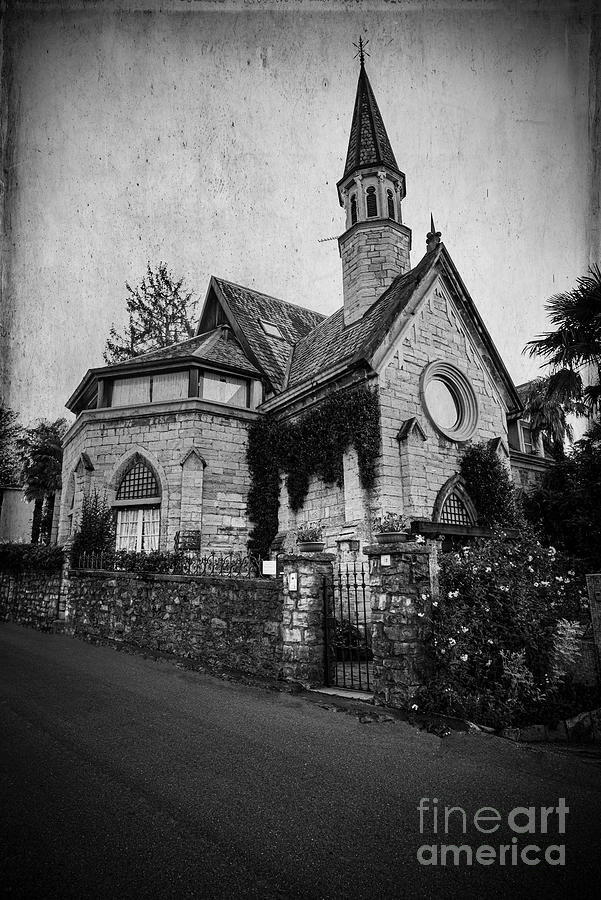
The height and width of the screenshot is (900, 601). In order to click on plants inside planters in this screenshot , I will do `click(385, 520)`, `click(309, 533)`.